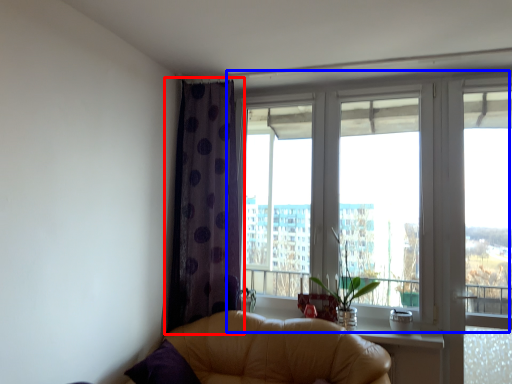
Question: Which object is closer to the camera taking this photo, curtain (highlighted by a red box) or window (highlighted by a blue box)?

Choices:
 (A) curtain
 (B) window

Answer: (B)